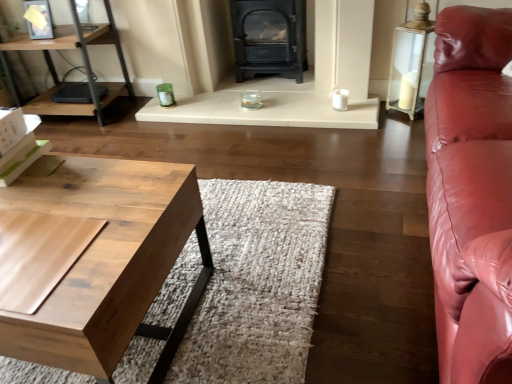
Question: Should I look upward or downward to see matte black wood burning stove at center?

Choices:
 (A) up
 (B) down

Answer: (A)

Question: Can you confirm if natural wood coffee table at lower left is positioned to the left of matte black wood burning stove at center?

Choices:
 (A) yes
 (B) no

Answer: (A)

Question: Considering the relative sizes of natural wood coffee table at lower left and matte black wood burning stove at center in the image provided, is natural wood coffee table at lower left bigger than matte black wood burning stove at center?

Choices:
 (A) no
 (B) yes

Answer: (B)

Question: Is natural wood coffee table at lower left shorter than matte black wood burning stove at center?

Choices:
 (A) yes
 (B) no

Answer: (A)

Question: Considering the relative sizes of natural wood coffee table at lower left and matte black wood burning stove at center in the image provided, is natural wood coffee table at lower left smaller than matte black wood burning stove at center?

Choices:
 (A) no
 (B) yes

Answer: (A)

Question: Can you confirm if natural wood coffee table at lower left is wider than matte black wood burning stove at center?

Choices:
 (A) yes
 (B) no

Answer: (A)

Question: Would you say natural wood coffee table at lower left is a long distance from matte black wood burning stove at center?

Choices:
 (A) no
 (B) yes

Answer: (B)

Question: From a real-world perspective, is black cast iron fireplace at center physically above wooden desk at left?

Choices:
 (A) no
 (B) yes

Answer: (A)

Question: Can you confirm if black cast iron fireplace at center is wider than wooden desk at left?

Choices:
 (A) yes
 (B) no

Answer: (B)

Question: Does black cast iron fireplace at center lie behind wooden desk at left?

Choices:
 (A) yes
 (B) no

Answer: (B)

Question: Does black cast iron fireplace at center have a lesser height compared to wooden desk at left?

Choices:
 (A) yes
 (B) no

Answer: (A)

Question: Is black cast iron fireplace at center far from wooden desk at left?

Choices:
 (A) yes
 (B) no

Answer: (B)

Question: Is black cast iron fireplace at center oriented away from wooden desk at left?

Choices:
 (A) yes
 (B) no

Answer: (B)

Question: Is wooden desk at left further to the viewer compared to matte black wood burning stove at center?

Choices:
 (A) yes
 (B) no

Answer: (B)